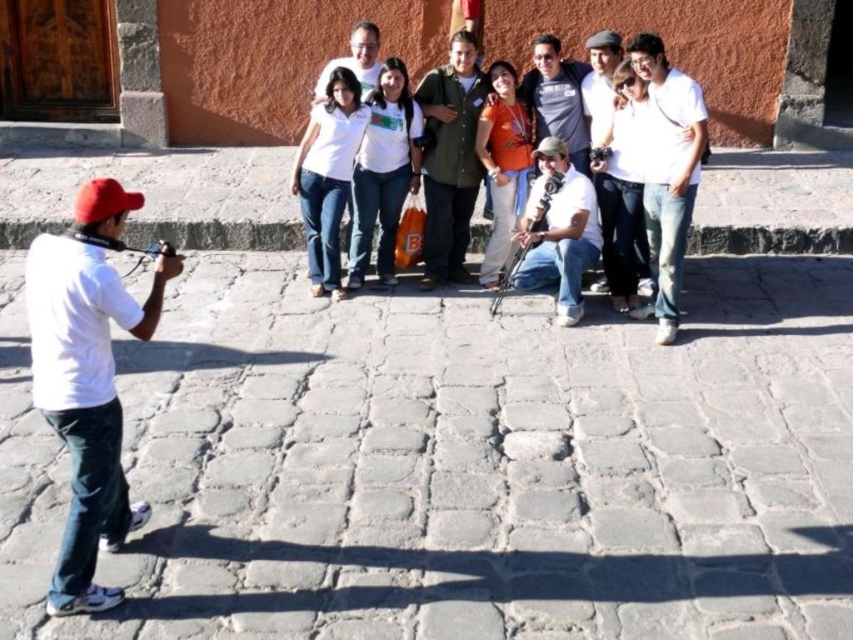
You are standing in front of the building and see the matte white camera at center and the white matte shirt at center. Which object is nearer to you?

The matte white camera at center is closer to the viewer than the white matte shirt at center.

You are standing at the center of the cobblestone street and want to take a photo of the white cotton shirt at upper right. Which direction should you move to get a better shot?

The white cotton shirt at upper right is located at point (668, 170), so you should move to the right and upwards to get a better shot.

You are standing at the point labeled point (550, 54) and want to walk to the wooden door on the left side of the building. Is the point labeled point (602, 125) located between you and the wooden door?

Point (602, 125) is in front of point (550, 54), so yes, it is between you and the wooden door on the left side of the building.